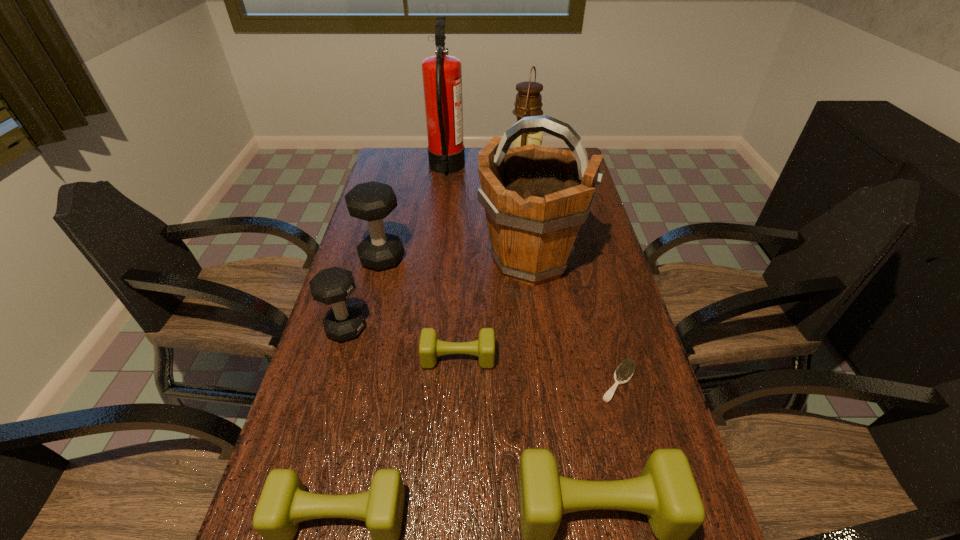
Find the location of a particular element. The width and height of the screenshot is (960, 540). fire extinguisher is located at coordinates [442, 74].

Identify the location of bucket. (535, 198).

Identify the location of oil lamp. Image resolution: width=960 pixels, height=540 pixels. (528, 103).

The image size is (960, 540). Find the location of `the farthest dumbbell`. the farthest dumbbell is located at coordinates (372, 201).

Find the location of `the bigger gray dumbbell`. the bigger gray dumbbell is located at coordinates (372, 201).

Where is `the second farthest dumbbell`? The height and width of the screenshot is (540, 960). the second farthest dumbbell is located at coordinates (334, 285).

At what (x,y) coordinates should I click in order to perform the action: click on the smaller gray dumbbell. Please return your answer as a coordinate pair (x, y). The height and width of the screenshot is (540, 960). Looking at the image, I should click on (334, 285).

This screenshot has width=960, height=540. Find the location of `the fourth dumbbell from left to right`. the fourth dumbbell from left to right is located at coordinates (430, 348).

This screenshot has height=540, width=960. What are the coordinates of `the shortest dumbbell` in the screenshot? It's located at (430, 348).

Locate an element on the screen. This screenshot has width=960, height=540. the shortest object is located at coordinates (624, 372).